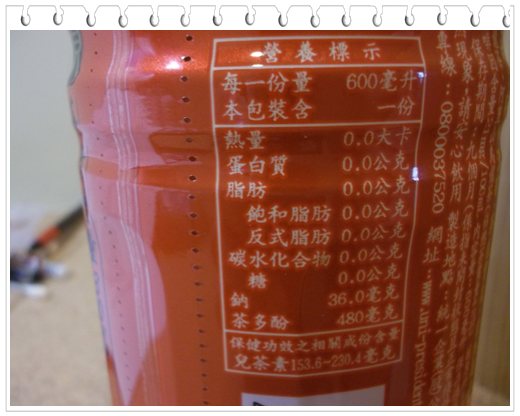
This screenshot has height=416, width=520. Find the location of `wall`. wall is located at coordinates (498, 312).